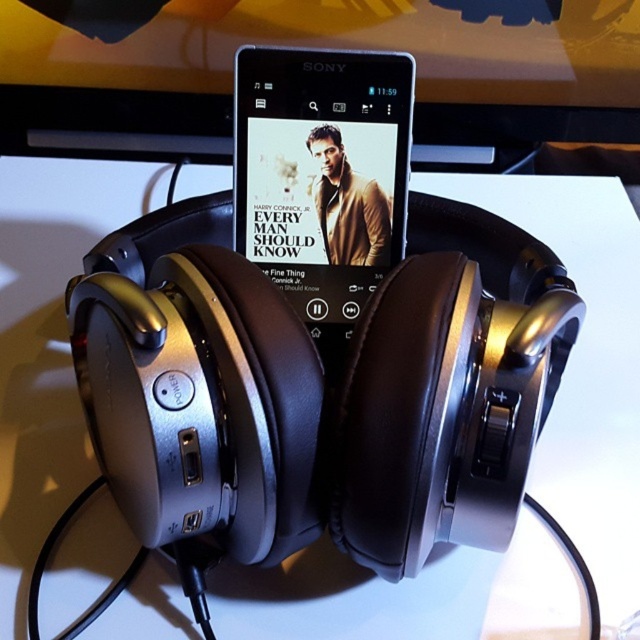
You are placing a new object on the white matte table at center. The table is represented by the point at coordinates (588, 362). If you want to place the object so that it is directly in front of the Sony smartphone, where should you position it relative to the point?

The Sony smartphone is on top of the headphones, which are resting on the white matte table at center. To place the object directly in front of the Sony smartphone, position it in the direction facing away from the headphones, maintaining the same horizontal level as the point at (588, 362).

You are a delivery person who needs to place a package on the white matte table at center. What are the coordinates where you should place the package?

The coordinates for the white matte table at center are at point [588,362], so you should place the package there.